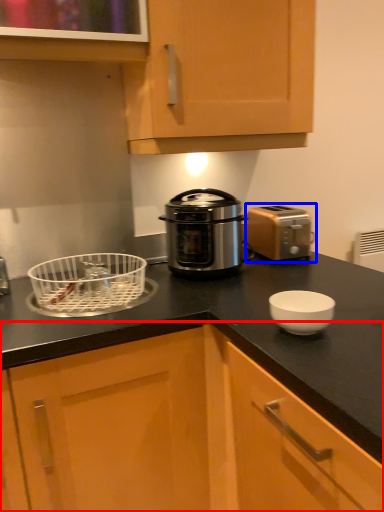
Question: Which of the following is the closest to the observer, cabinetry (highlighted by a red box) or toaster (highlighted by a blue box)?

Choices:
 (A) cabinetry
 (B) toaster

Answer: (A)